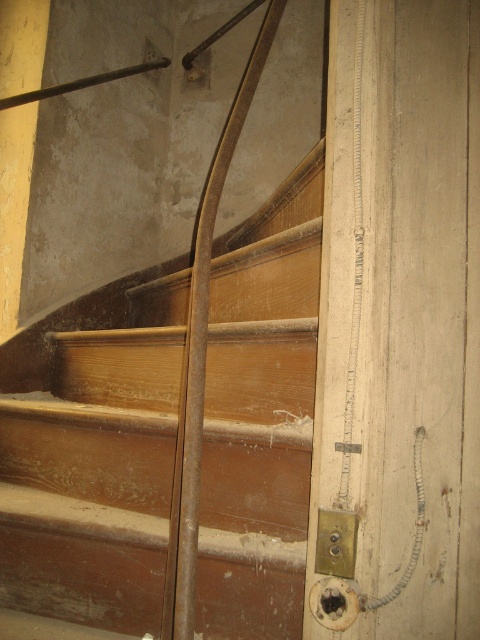
You are standing at the bottom of the staircase and want to reach the gold metallic lock at lower right. Which direction should you move relative to the brown wooden stairs at center?

The gold metallic lock at lower right is on the right side of the brown wooden stairs at center, so you should move to the right of the brown wooden stairs at center to reach it.

You are standing at the bottom of the staircase and notice the gold metallic lock at lower right and the brown wooden stairs at center. Which object is closer to you from your current position?

The gold metallic lock at lower right is behind the brown wooden stairs at center, so the brown wooden stairs at center is closer to you.